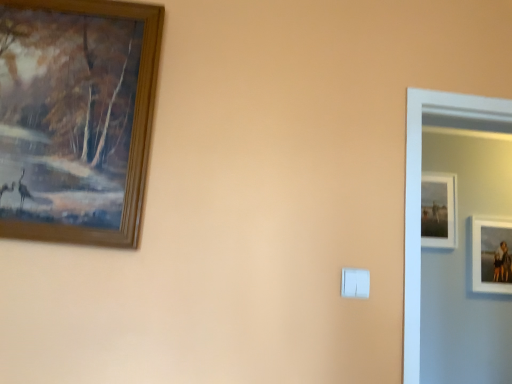
Question: Does matte white picture frame at upper right, which appears as the 1th picture frame when viewed from the back, contain white plastic light switch at center?

Choices:
 (A) yes
 (B) no

Answer: (B)

Question: Considering the relative positions of matte white picture frame at upper right, acting as the second picture frame starting from the left, and white plastic light switch at center in the image provided, is matte white picture frame at upper right, acting as the second picture frame starting from the left, to the left of white plastic light switch at center from the viewer's perspective?

Choices:
 (A) no
 (B) yes

Answer: (A)

Question: From a real-world perspective, is matte white picture frame at upper right, arranged as the 2th picture frame when viewed from the right, on white plastic light switch at center?

Choices:
 (A) no
 (B) yes

Answer: (B)

Question: Could you tell me if matte white picture frame at upper right, which appears as the 1th picture frame when viewed from the back, is facing white plastic light switch at center?

Choices:
 (A) no
 (B) yes

Answer: (A)

Question: Is matte white picture frame at upper right, the third picture frame when ordered from front to back, positioned in front of white plastic light switch at center?

Choices:
 (A) no
 (B) yes

Answer: (A)

Question: Considering the positions of matte white picture frame at upper right, acting as the second picture frame starting from the left, and wooden picture frame at upper left, acting as the 3th picture frame starting from the right, in the image, is matte white picture frame at upper right, acting as the second picture frame starting from the left, bigger or smaller than wooden picture frame at upper left, acting as the 3th picture frame starting from the right,?

Choices:
 (A) small
 (B) big

Answer: (A)

Question: Is matte white picture frame at upper right, the third picture frame when ordered from front to back, wider or thinner than wooden picture frame at upper left, which is counted as the 3th picture frame, starting from the back?

Choices:
 (A) thin
 (B) wide

Answer: (A)

Question: From the image's perspective, is matte white picture frame at upper right, which appears as the 1th picture frame when viewed from the back, above or below wooden picture frame at upper left, which appears as the first picture frame when viewed from the front?

Choices:
 (A) below
 (B) above

Answer: (A)

Question: Considering the positions of point (448, 185) and point (66, 230), is point (448, 185) closer or farther from the camera than point (66, 230)?

Choices:
 (A) closer
 (B) farther

Answer: (B)

Question: Looking at the image, does white matte picture frame at right, the second picture frame positioned from the back, seem bigger or smaller compared to white plastic light switch at center?

Choices:
 (A) big
 (B) small

Answer: (A)

Question: Considering the positions of white matte picture frame at right, marked as the third picture frame in a left-to-right arrangement, and white plastic light switch at center in the image, is white matte picture frame at right, marked as the third picture frame in a left-to-right arrangement, wider or thinner than white plastic light switch at center?

Choices:
 (A) thin
 (B) wide

Answer: (B)

Question: From a real-world perspective, is white matte picture frame at right, placed as the first picture frame when sorted from right to left, physically located above or below white plastic light switch at center?

Choices:
 (A) below
 (B) above

Answer: (B)

Question: Is point (478, 251) positioned closer to the camera than point (367, 286)?

Choices:
 (A) farther
 (B) closer

Answer: (A)

Question: In terms of size, does white plastic light switch at center appear bigger or smaller than wooden picture frame at upper left, which is counted as the 3th picture frame, starting from the back?

Choices:
 (A) big
 (B) small

Answer: (B)

Question: Is white plastic light switch at center inside the boundaries of wooden picture frame at upper left, the first picture frame positioned from the left, or outside?

Choices:
 (A) inside
 (B) outside

Answer: (B)